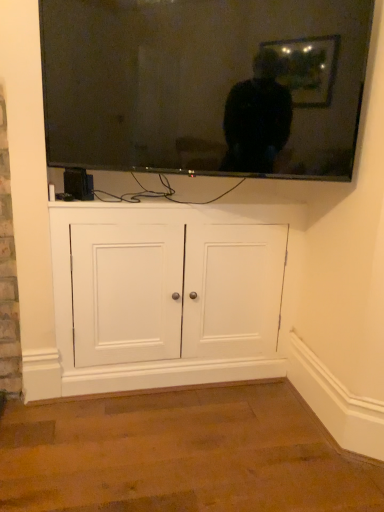
Question: From a real-world perspective, is flat screen tv at upper center positioned under white wood cabinet at center based on gravity?

Choices:
 (A) yes
 (B) no

Answer: (B)

Question: Is flat screen tv at upper center thinner than white wood cabinet at center?

Choices:
 (A) yes
 (B) no

Answer: (A)

Question: Considering the relative sizes of flat screen tv at upper center and white wood cabinet at center in the image provided, is flat screen tv at upper center smaller than white wood cabinet at center?

Choices:
 (A) yes
 (B) no

Answer: (A)

Question: Is flat screen tv at upper center completely or partially outside of white wood cabinet at center?

Choices:
 (A) yes
 (B) no

Answer: (A)

Question: Considering the relative positions of flat screen tv at upper center and white wood cabinet at center in the image provided, is flat screen tv at upper center behind white wood cabinet at center?

Choices:
 (A) no
 (B) yes

Answer: (A)

Question: Does flat screen tv at upper center appear on the left side of white wood cabinet at center?

Choices:
 (A) yes
 (B) no

Answer: (B)

Question: Is white wood cabinet at center taller than flat screen tv at upper center?

Choices:
 (A) no
 (B) yes

Answer: (B)

Question: Is white wood cabinet at center oriented away from flat screen tv at upper center?

Choices:
 (A) no
 (B) yes

Answer: (A)

Question: Could flat screen tv at upper center be considered to be inside white wood cabinet at center?

Choices:
 (A) no
 (B) yes

Answer: (A)

Question: Would you say white wood cabinet at center is a long distance from flat screen tv at upper center?

Choices:
 (A) yes
 (B) no

Answer: (B)

Question: Can you confirm if white wood cabinet at center is wider than flat screen tv at upper center?

Choices:
 (A) no
 (B) yes

Answer: (B)

Question: Is white wood cabinet at center further to camera compared to flat screen tv at upper center?

Choices:
 (A) no
 (B) yes

Answer: (B)

Question: Is flat screen tv at upper center to the left or to the right of white wood cabinet at center in the image?

Choices:
 (A) left
 (B) right

Answer: (B)